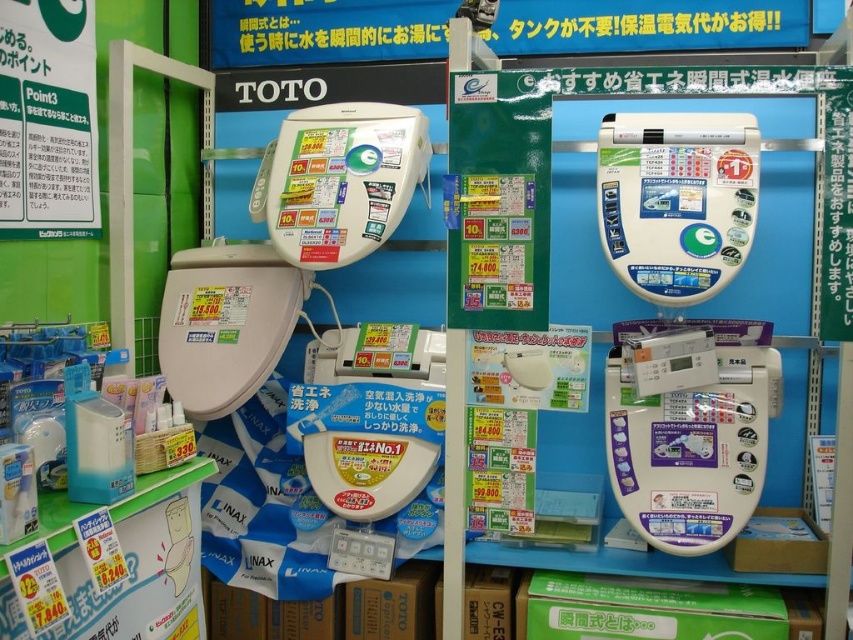
Question: Estimate the real-world distances between objects in this image. Which object is closer to the matte white toilet at center?

Choices:
 (A) white glossy toilet seat at center
 (B) white plastic shelf at lower left

Answer: (B)

Question: Which point is closer to the camera?

Choices:
 (A) (662, 547)
 (B) (171, 278)

Answer: (A)

Question: Which object is closer to the camera taking this photo?

Choices:
 (A) matte white toilet at center
 (B) white plastic shelf at lower left
 (C) white glossy toilet seat at center

Answer: (B)

Question: Is white glossy toilet seat at center closer to the viewer compared to matte white toilet at center?

Choices:
 (A) no
 (B) yes

Answer: (B)

Question: Does white plastic shelf at lower left come behind matte white toilet at center?

Choices:
 (A) no
 (B) yes

Answer: (A)

Question: Is white glossy toilet seat at center positioned before white plastic shelf at lower left?

Choices:
 (A) yes
 (B) no

Answer: (B)